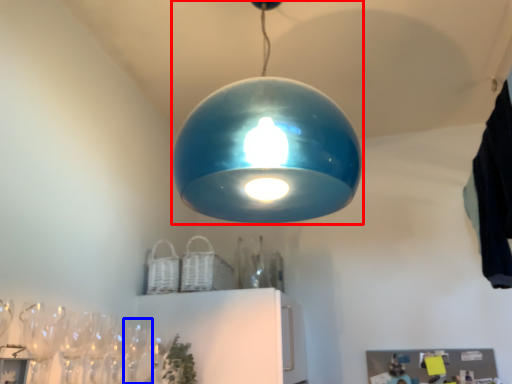
Question: Which point is closer to the camera, lamp (highlighted by a red box) or wine glass (highlighted by a blue box)?

Choices:
 (A) lamp
 (B) wine glass

Answer: (A)